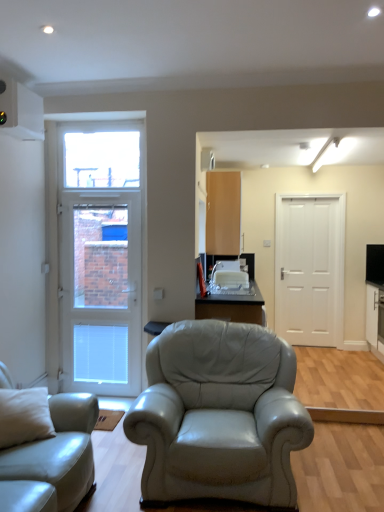
Question: Can you confirm if transparent glass window at upper left is positioned to the left of light beige leather couch at lower left?

Choices:
 (A) yes
 (B) no

Answer: (B)

Question: Is transparent glass window at upper left in front of light beige leather couch at lower left?

Choices:
 (A) no
 (B) yes

Answer: (A)

Question: Considering the relative positions of transparent glass window at upper left and light beige leather couch at lower left in the image provided, is transparent glass window at upper left to the right of light beige leather couch at lower left from the viewer's perspective?

Choices:
 (A) yes
 (B) no

Answer: (A)

Question: From the image's perspective, is transparent glass window at upper left on light beige leather couch at lower left?

Choices:
 (A) yes
 (B) no

Answer: (A)

Question: From a real-world perspective, is transparent glass window at upper left beneath light beige leather couch at lower left?

Choices:
 (A) yes
 (B) no

Answer: (B)

Question: Is transparent glass window at upper left taller than light beige leather couch at lower left?

Choices:
 (A) no
 (B) yes

Answer: (A)

Question: Is matte black table at center shorter than white glossy cabinet at right?

Choices:
 (A) no
 (B) yes

Answer: (B)

Question: Is matte black table at center looking in the opposite direction of white glossy cabinet at right?

Choices:
 (A) yes
 (B) no

Answer: (B)

Question: Does matte black table at center appear on the right side of white glossy cabinet at right?

Choices:
 (A) yes
 (B) no

Answer: (B)

Question: Is the depth of matte black table at center greater than that of white glossy cabinet at right?

Choices:
 (A) yes
 (B) no

Answer: (B)

Question: Can you confirm if matte black table at center is smaller than white glossy cabinet at right?

Choices:
 (A) yes
 (B) no

Answer: (B)

Question: Does matte black table at center have a greater width compared to white glossy cabinet at right?

Choices:
 (A) no
 (B) yes

Answer: (B)

Question: Considering the relative sizes of matte wood cabinet at upper center and transparent glass window at upper left in the image provided, is matte wood cabinet at upper center bigger than transparent glass window at upper left?

Choices:
 (A) no
 (B) yes

Answer: (B)